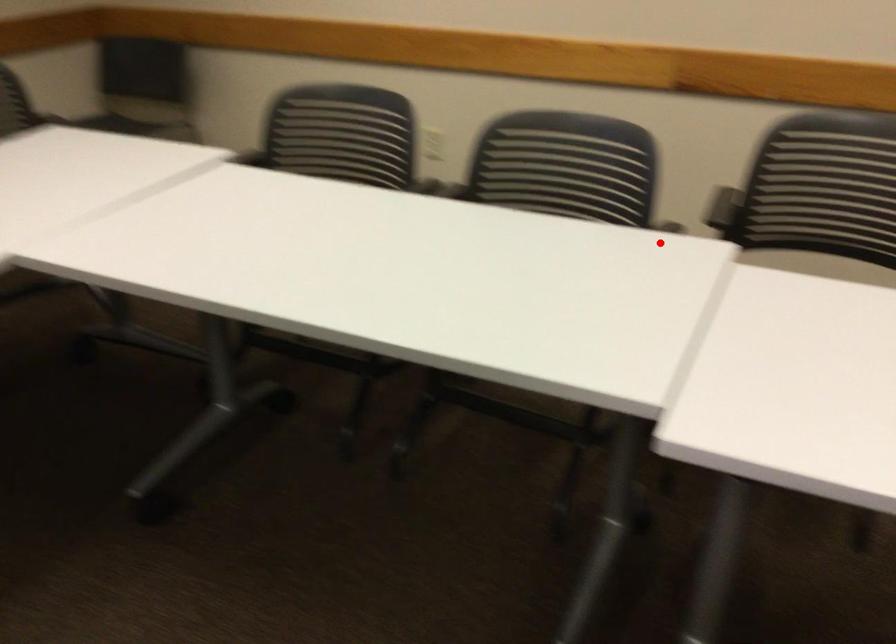
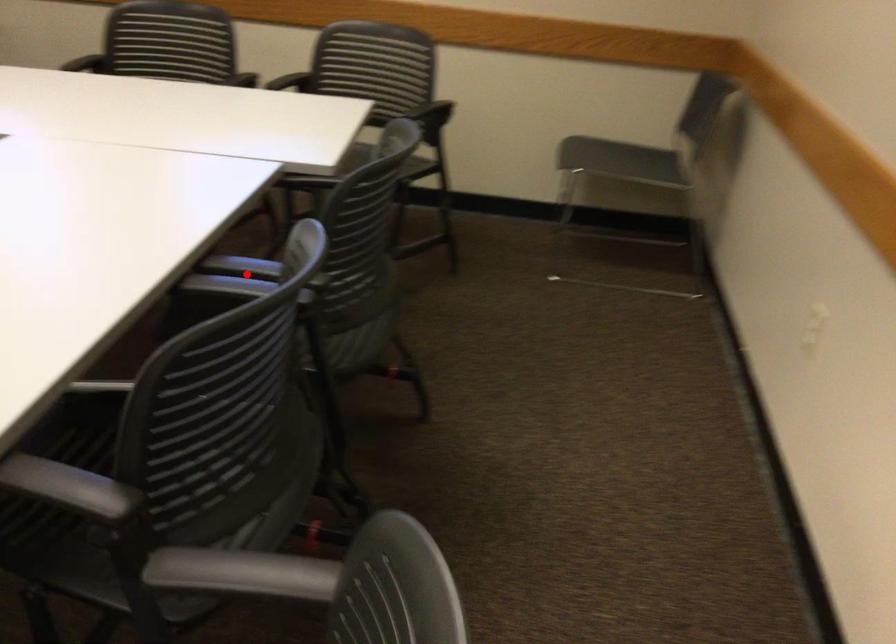
I am providing you with two images of the same scene from different viewpoints. A red point is marked on the first image and another point is marked on the second image. Is the red point in image1 aligned with the point shown in image2?

No